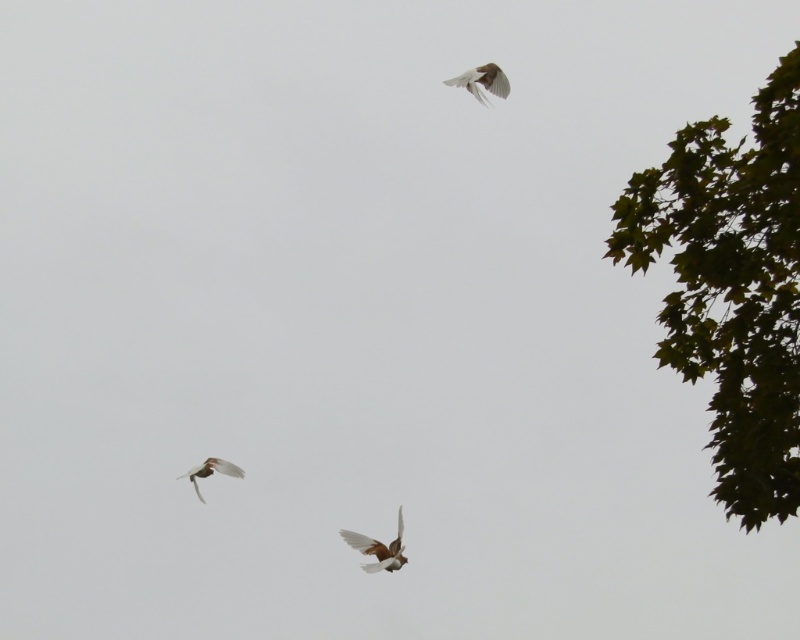
Question: Which of these objects is positioned farthest from the brown feathered bird at center?

Choices:
 (A) white feathered bird at upper center
 (B) green leafy tree at upper right

Answer: (B)

Question: Which point is closer to the camera?

Choices:
 (A) (400, 557)
 (B) (725, 160)

Answer: (B)

Question: Is brown feathered bird at center bigger than white feathered bird at lower left?

Choices:
 (A) no
 (B) yes

Answer: (B)

Question: Is green leafy tree at upper right below brown feathered bird at center?

Choices:
 (A) no
 (B) yes

Answer: (A)

Question: Does green leafy tree at upper right appear on the right side of white feathered bird at upper center?

Choices:
 (A) yes
 (B) no

Answer: (A)

Question: Which point is farther to the camera?

Choices:
 (A) brown feathered bird at center
 (B) green leafy tree at upper right
 (C) white feathered bird at lower left

Answer: (C)